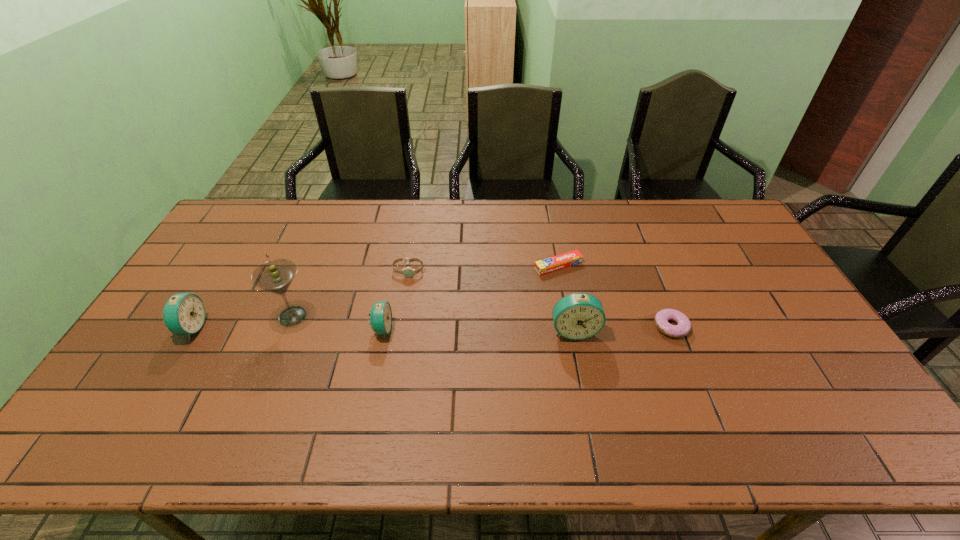
The alarm clocks are evenly distributed in the image. To maintain this, where would you place another alarm clock on the right? Please point to a free space. Please provide its 2D coordinates. Your answer should be formatted as a tuple, i.e. [(x, y)], where the tuple contains the x and y coordinates of a point satisfying the conditions above.

[(767, 332)]